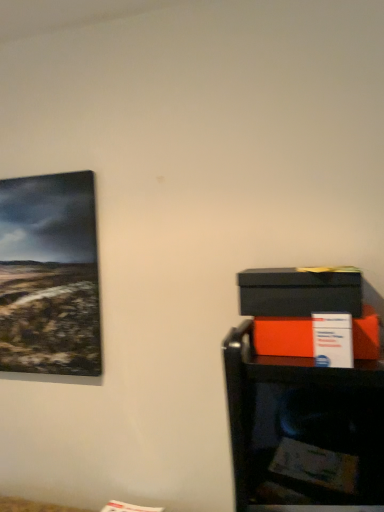
Question: Can you confirm if matte orange box at right, arranged as the 2th box when viewed from the top, is wider than matte black cabinet at lower right?

Choices:
 (A) yes
 (B) no

Answer: (A)

Question: Does matte orange box at right, arranged as the 2th box when viewed from the top, turn towards matte black cabinet at lower right?

Choices:
 (A) no
 (B) yes

Answer: (A)

Question: From a real-world perspective, is matte orange box at right, arranged as the 2th box when viewed from the top, below matte black cabinet at lower right?

Choices:
 (A) no
 (B) yes

Answer: (A)

Question: From a real-world perspective, is matte orange box at right, arranged as the 2th box when viewed from the top, on top of matte black cabinet at lower right?

Choices:
 (A) yes
 (B) no

Answer: (A)

Question: Is matte orange box at right, arranged as the 2th box when viewed from the top, directly adjacent to matte black cabinet at lower right?

Choices:
 (A) yes
 (B) no

Answer: (B)

Question: Considering the relative positions of matte black cabinet at lower right and matte orange box at right, arranged as the 2th box when viewed from the top, in the image provided, is matte black cabinet at lower right to the left or to the right of matte orange box at right, arranged as the 2th box when viewed from the top,?

Choices:
 (A) right
 (B) left

Answer: (A)

Question: From a real-world perspective, is matte black cabinet at lower right physically located above or below matte orange box at right, which is the first box in bottom-to-top order?

Choices:
 (A) above
 (B) below

Answer: (B)

Question: From the image's perspective, is matte black cabinet at lower right located above or below matte orange box at right, arranged as the 2th box when viewed from the top?

Choices:
 (A) above
 (B) below

Answer: (B)

Question: Based on their sizes in the image, would you say matte black cabinet at lower right is bigger or smaller than matte orange box at right, which is the first box in bottom-to-top order?

Choices:
 (A) big
 (B) small

Answer: (A)

Question: From a real-world perspective, is matte black box at right, marked as the first box in a top-to-bottom arrangement, positioned above or below matte black cabinet at lower right?

Choices:
 (A) below
 (B) above

Answer: (B)

Question: Is matte black box at right, marked as the first box in a top-to-bottom arrangement, in front of or behind matte black cabinet at lower right in the image?

Choices:
 (A) behind
 (B) front

Answer: (B)

Question: Visually, is matte black box at right, which is the 2th box from bottom to top, positioned to the left or to the right of matte black cabinet at lower right?

Choices:
 (A) left
 (B) right

Answer: (A)

Question: Considering the positions of matte black box at right, marked as the first box in a top-to-bottom arrangement, and matte black cabinet at lower right in the image, is matte black box at right, marked as the first box in a top-to-bottom arrangement, bigger or smaller than matte black cabinet at lower right?

Choices:
 (A) small
 (B) big

Answer: (A)

Question: Considering the positions of matte black box at right, marked as the first box in a top-to-bottom arrangement, and matte orange box at right, which is the first box in bottom-to-top order, in the image, is matte black box at right, marked as the first box in a top-to-bottom arrangement, taller or shorter than matte orange box at right, which is the first box in bottom-to-top order,?

Choices:
 (A) short
 (B) tall

Answer: (B)

Question: In terms of width, does matte black box at right, which is the 2th box from bottom to top, look wider or thinner when compared to matte orange box at right, which is the first box in bottom-to-top order?

Choices:
 (A) thin
 (B) wide

Answer: (B)